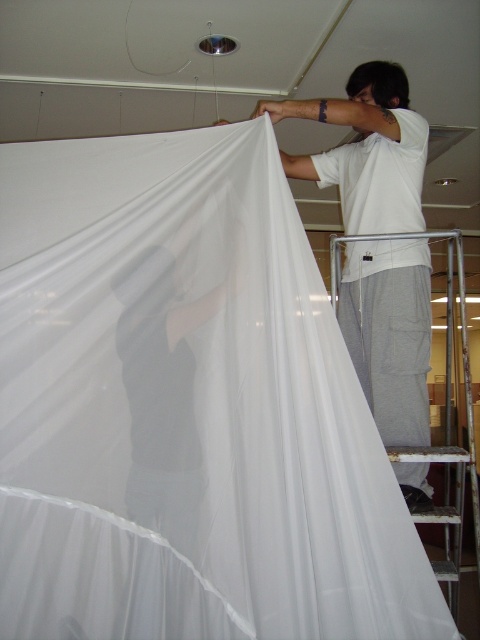
Is white sheer fabric at upper right to the left of black fabric at center from the viewer's perspective?

In fact, white sheer fabric at upper right is to the right of black fabric at center.

Can you confirm if white sheer fabric at upper right is positioned to the right of black fabric at center?

Indeed, white sheer fabric at upper right is positioned on the right side of black fabric at center.

Where is `white sheer fabric at upper right`? This screenshot has width=480, height=640. white sheer fabric at upper right is located at coordinates (389, 332).